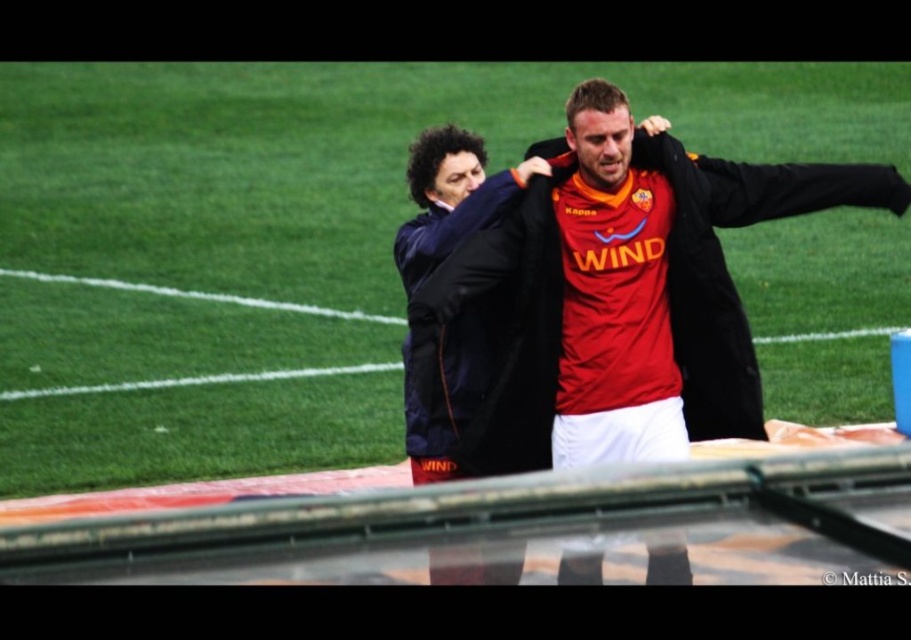
Question: Is green grass football field at center to the right of matte black jacket at center from the viewer's perspective?

Choices:
 (A) no
 (B) yes

Answer: (A)

Question: Is green grass football field at center to the left of matte black jacket at center from the viewer's perspective?

Choices:
 (A) yes
 (B) no

Answer: (A)

Question: Which point is farther from the camera taking this photo?

Choices:
 (A) (899, 563)
 (B) (274, 397)

Answer: (B)

Question: Which point is farther from the camera taking this photo?

Choices:
 (A) (316, 333)
 (B) (509, 248)

Answer: (A)

Question: Which point is closer to the camera?

Choices:
 (A) green grass football field at center
 (B) matte black jacket at center

Answer: (B)

Question: Where is green grass football field at center located in relation to matte black jacket at center in the image?

Choices:
 (A) below
 (B) above

Answer: (B)